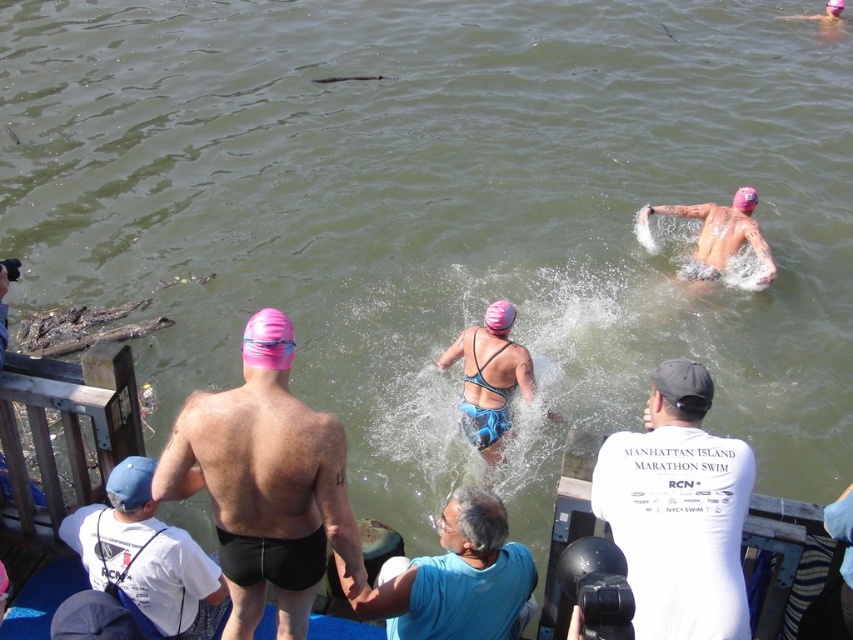
Describe the element at coordinates (717, 237) in the screenshot. I see `smooth skin tattooed man at center` at that location.

How much distance is there between smooth skin tattooed man at center and pink rubber swim cap at center?

They are 8.73 meters apart.

Is point (711, 234) behind point (260, 330)?

Yes, it is.

Find the location of a particular element. This screenshot has width=853, height=640. smooth skin tattooed man at center is located at coordinates (717, 237).

Based on the photo, does pink matte swim cap at upper left have a smaller size compared to pink rubber swim cap at center?

Incorrect, pink matte swim cap at upper left is not smaller in size than pink rubber swim cap at center.

Does pink matte swim cap at upper left appear on the left side of pink rubber swim cap at center?

Yes, pink matte swim cap at upper left is to the left of pink rubber swim cap at center.

Is point (260, 433) farther from viewer compared to point (242, 352)?

No, it is in front of (242, 352).

The image size is (853, 640). Identify the location of pink matte swim cap at upper left. (265, 493).

Can you confirm if white cotton t-shirt at center is positioned above pink rubber swim cap at center?

No.

Can you confirm if white cotton t-shirt at center is positioned to the right of pink rubber swim cap at center?

Indeed, white cotton t-shirt at center is positioned on the right side of pink rubber swim cap at center.

Who is more forward, (706, 584) or (248, 321)?

Positioned in front is point (706, 584).

Where is `white cotton t-shirt at center`? This screenshot has width=853, height=640. white cotton t-shirt at center is located at coordinates (677, 509).